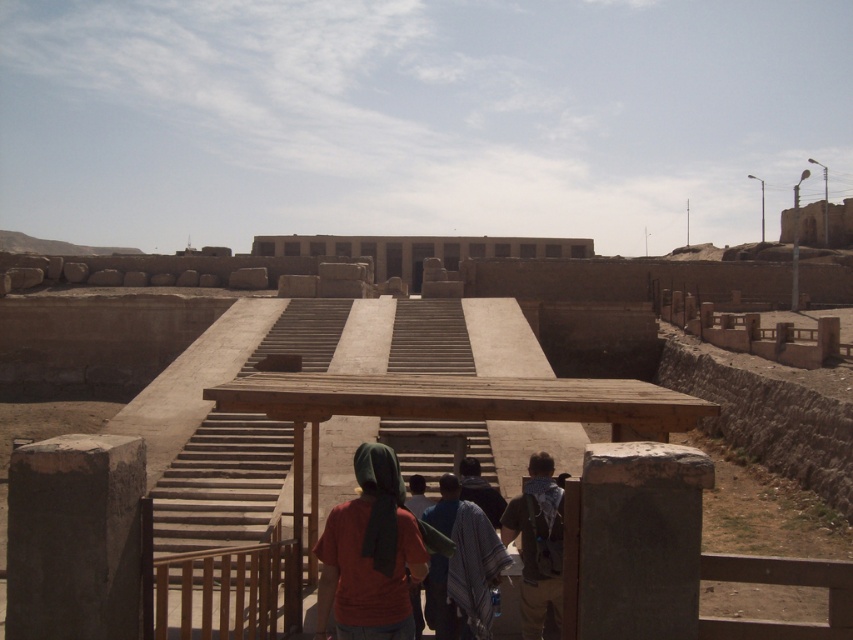
Does brown stone amphitheater at center appear over matte red shirt at center?

Yes.

Who is taller, brown stone amphitheater at center or matte red shirt at center?

brown stone amphitheater at center is taller.

At what (x,y) coordinates should I click in order to perform the action: click on brown stone amphitheater at center. Please return your answer as a coordinate pair (x, y). Looking at the image, I should click on (659, 340).

Which is in front, point (398, 604) or point (546, 557)?

Positioned in front is point (398, 604).

Does matte red shirt at center appear on the left side of camouflage-patterned backpack at center?

Indeed, matte red shirt at center is positioned on the left side of camouflage-patterned backpack at center.

You are a GUI agent. You are given a task and a screenshot of the screen. Output one action in this format:
    pyautogui.click(x=<x>, y=<y>)
    Task: Click on the matte red shirt at center
    The height and width of the screenshot is (640, 853).
    Given the screenshot: What is the action you would take?
    pyautogui.click(x=370, y=554)

What are the coordinates of `matte red shirt at center` in the screenshot? It's located at (370, 554).

Measure the distance between point (393, 490) and camera.

Point (393, 490) is 7.05 meters from camera.

This screenshot has width=853, height=640. I want to click on matte red shirt at center, so click(x=370, y=554).